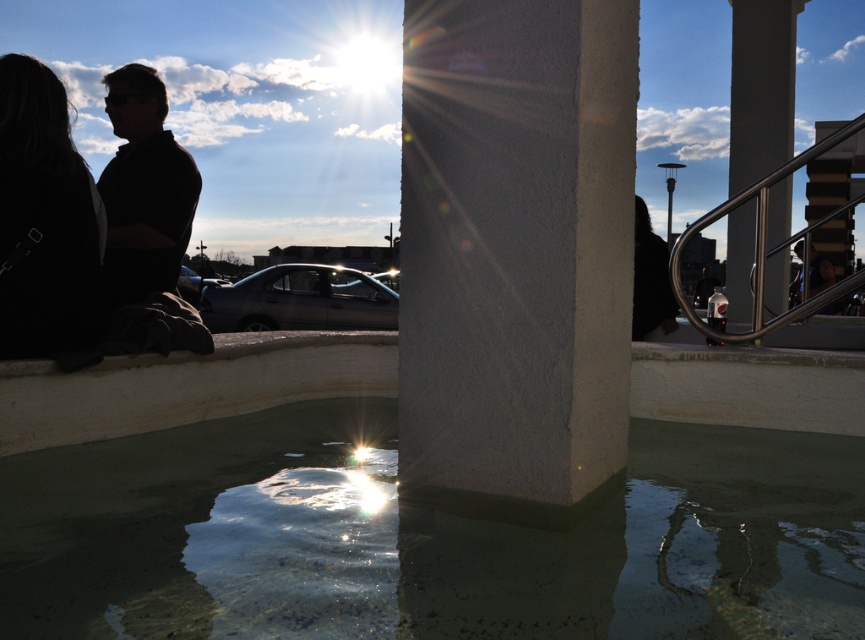
You are standing at the origin point in the image and want to move towards the car parked behind the pillar. Which point, point (739, 64) or point (836, 296), is closer to the car?

Point (739, 64) is behind point (836, 296), so the closer point to the car is point (836, 296).